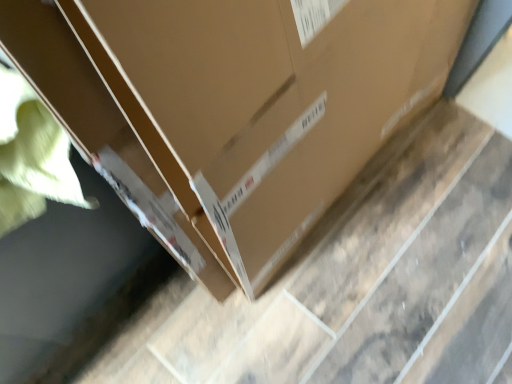
Find the location of a particular element. This screenshot has width=512, height=384. brown cardboard box at center is located at coordinates (236, 105).

In order to face brown cardboard box at center, should I rotate leftwards or rightwards?

Rotate right and turn 13.688 degrees.

What do you see at coordinates (236, 105) in the screenshot? This screenshot has height=384, width=512. I see `brown cardboard box at center` at bounding box center [236, 105].

The image size is (512, 384). I want to click on brown cardboard box at center, so coord(236,105).